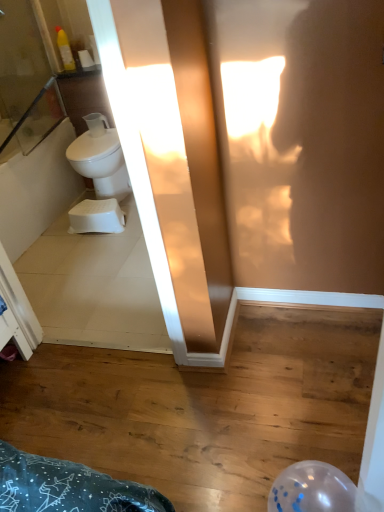
You are a GUI agent. You are given a task and a screenshot of the screen. Output one action in this format:
    pyautogui.click(x=<x>, y=<y>)
    Task: Click on the clear glass screen door at upper left
    This screenshot has width=384, height=512.
    Given the screenshot: What is the action you would take?
    pyautogui.click(x=26, y=78)

At what (x,y) coordinates should I click in order to perform the action: click on white plastic step stool at lower left. Please return your answer as a coordinate pair (x, y). Looking at the image, I should click on (97, 217).

Considering the sizes of objects white glossy toilet at left and white plastic step stool at lower left in the image provided, who is smaller, white glossy toilet at left or white plastic step stool at lower left?

Smaller between the two is white plastic step stool at lower left.

Is white glossy toilet at left facing away from white plastic step stool at lower left?

No, white glossy toilet at left is not facing away from white plastic step stool at lower left.

Does white glossy toilet at left have a greater width compared to white plastic step stool at lower left?

Yes.

In terms of width, does white plastic step stool at lower left look wider or thinner when compared to white matte toilet paper at upper left?

Clearly, white plastic step stool at lower left has more width compared to white matte toilet paper at upper left.

From the image's perspective, which is below, white plastic step stool at lower left or white matte toilet paper at upper left?

white plastic step stool at lower left.

Is white plastic step stool at lower left not close to white matte toilet paper at upper left?

Yes, white plastic step stool at lower left is far from white matte toilet paper at upper left.

Is white plastic step stool at lower left inside the boundaries of white matte toilet paper at upper left, or outside?

The correct answer is: outside.

Is clear glass screen door at upper left situated inside white plastic step stool at lower left or outside?

clear glass screen door at upper left is located beyond the bounds of white plastic step stool at lower left.

Which of these two, clear glass screen door at upper left or white plastic step stool at lower left, is wider?

white plastic step stool at lower left.

This screenshot has height=512, width=384. Identify the location of toilet bowl below the clear glass screen door at upper left (from the image's perspective). (97, 217).

Relative to white plastic step stool at lower left, is clear glass screen door at upper left in front or behind?

clear glass screen door at upper left is in front of white plastic step stool at lower left.

Who is shorter, clear glass screen door at upper left or white matte toilet paper at upper left?

With less height is white matte toilet paper at upper left.

Is clear glass screen door at upper left oriented towards white matte toilet paper at upper left?

Yes, clear glass screen door at upper left faces towards white matte toilet paper at upper left.

Does point (3, 82) appear closer or farther from the camera than point (87, 57)?

Point (3, 82) appears to be farther away from the viewer than point (87, 57).

Can you confirm if white glossy toilet at left is shorter than clear glass screen door at upper left?

Yes.

You are a GUI agent. You are given a task and a screenshot of the screen. Output one action in this format:
    pyautogui.click(x=<x>, y=<y>)
    Task: Click on the screen door on the left of the white glossy toilet at left
    
    Given the screenshot: What is the action you would take?
    pyautogui.click(x=26, y=78)

Would you say white glossy toilet at left is a long distance from clear glass screen door at upper left?

No, white glossy toilet at left is not far away from clear glass screen door at upper left.

Considering the relative sizes of clear glass screen door at upper left and white glossy toilet at left in the image provided, is clear glass screen door at upper left bigger than white glossy toilet at left?

No, clear glass screen door at upper left is not bigger than white glossy toilet at left.

Can you confirm if clear glass screen door at upper left is taller than white glossy toilet at left?

Yes.

From a real-world perspective, who is located higher, clear glass screen door at upper left or white glossy toilet at left?

clear glass screen door at upper left is physically above.

Is white glossy toilet at left completely or partially inside white matte toilet paper at upper left?

No, white glossy toilet at left is not surrounded by white matte toilet paper at upper left.

Between white matte toilet paper at upper left and white glossy toilet at left, which one has less height?

Standing shorter between the two is white matte toilet paper at upper left.

Is white matte toilet paper at upper left further to the viewer compared to white glossy toilet at left?

Yes, it is.

From the image's perspective, is white matte toilet paper at upper left under white glossy toilet at left?

No, from the image's perspective, white matte toilet paper at upper left is not below white glossy toilet at left.

You are a GUI agent. You are given a task and a screenshot of the screen. Output one action in this format:
    pyautogui.click(x=<x>, y=<y>)
    Task: Click on the toilet on the left of the white plastic step stool at lower left
    
    Given the screenshot: What is the action you would take?
    pyautogui.click(x=100, y=158)

Where is `toilet paper above the white plastic step stool at lower left (from a real-world perspective)`? The height and width of the screenshot is (512, 384). toilet paper above the white plastic step stool at lower left (from a real-world perspective) is located at coordinates (86, 60).

Considering their positions, is clear glass screen door at upper left positioned further to white plastic step stool at lower left than white glossy toilet at left?

clear glass screen door at upper left lies further to white plastic step stool at lower left than the other object.

Looking at the image, which one is located further to white glossy toilet at left, clear glass screen door at upper left or white matte toilet paper at upper left?

Among the two, white matte toilet paper at upper left is located further to white glossy toilet at left.

Looking at the image, which one is located closer to white plastic step stool at lower left, white matte toilet paper at upper left or white glossy toilet at left?

white glossy toilet at left.

Based on their spatial positions, is white plastic step stool at lower left or white glossy toilet at left closer to clear glass screen door at upper left?

The object closer to clear glass screen door at upper left is white glossy toilet at left.

Estimate the real-world distances between objects in this image. Which object is further from white glossy toilet at left, white plastic step stool at lower left or white matte toilet paper at upper left?

white matte toilet paper at upper left lies further to white glossy toilet at left than the other object.

When comparing their distances from clear glass screen door at upper left, does white glossy toilet at left or white matte toilet paper at upper left seem closer?

white matte toilet paper at upper left is positioned closer to the anchor clear glass screen door at upper left.

Estimate the real-world distances between objects in this image. Which object is closer to white matte toilet paper at upper left, clear glass screen door at upper left or white plastic step stool at lower left?

clear glass screen door at upper left lies closer to white matte toilet paper at upper left than the other object.

From the image, which object appears to be farther from white matte toilet paper at upper left, white plastic step stool at lower left or clear glass screen door at upper left?

white plastic step stool at lower left.

Find the location of a particular element. screen door between white matte toilet paper at upper left and white plastic step stool at lower left vertically is located at coordinates (26, 78).

Where is `toilet between white matte toilet paper at upper left and white plastic step stool at lower left vertically`? This screenshot has width=384, height=512. toilet between white matte toilet paper at upper left and white plastic step stool at lower left vertically is located at coordinates (100, 158).

You are a GUI agent. You are given a task and a screenshot of the screen. Output one action in this format:
    pyautogui.click(x=<x>, y=<y>)
    Task: Click on the toilet that lies between clear glass screen door at upper left and white plastic step stool at lower left from top to bottom
    The width and height of the screenshot is (384, 512).
    Given the screenshot: What is the action you would take?
    pyautogui.click(x=100, y=158)

At what (x,y) coordinates should I click in order to perform the action: click on screen door between white matte toilet paper at upper left and white glossy toilet at left from top to bottom. Please return your answer as a coordinate pair (x, y). Looking at the image, I should click on (26, 78).